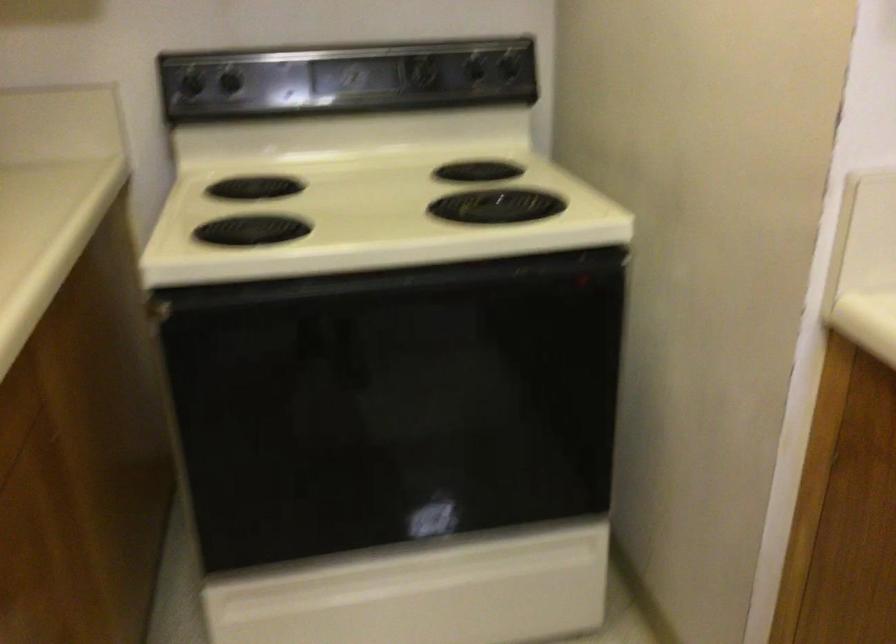
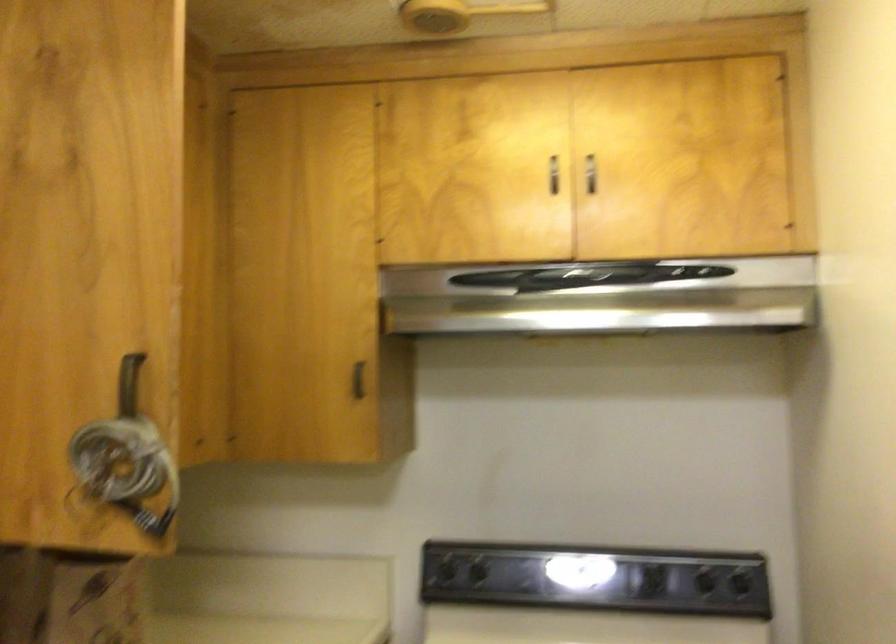
The first image is from the beginning of the video and the second image is from the end. How did the camera likely rotate when shooting the video?

The camera's rotation is toward left-up.